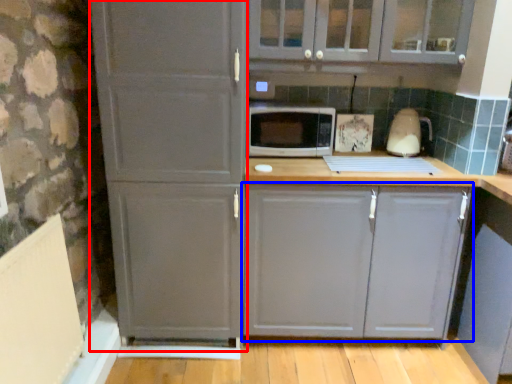
Question: Which object appears closest to the camera in this image, screen door (highlighted by a red box) or cabinetry (highlighted by a blue box)?

Choices:
 (A) screen door
 (B) cabinetry

Answer: (A)